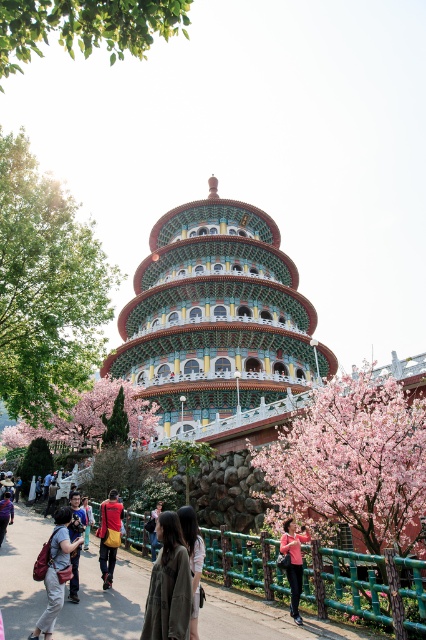
The width and height of the screenshot is (426, 640). What do you see at coordinates (109, 536) in the screenshot? I see `red fabric backpack at center` at bounding box center [109, 536].

Is the position of red fabric backpack at center less distant than that of matte red backpack at center?

Yes, red fabric backpack at center is closer to the viewer.

Is point (112, 492) positioned in front of point (85, 502)?

Yes, point (112, 492) is in front of point (85, 502).

Locate an element on the screen. The image size is (426, 640). red fabric backpack at center is located at coordinates (109, 536).

Looking at this image, does green leafy tree at upper left have a greater height compared to dark gray fabric jacket at lower center?

Yes.

Does green leafy tree at upper left appear on the right side of dark gray fabric jacket at lower center?

No, green leafy tree at upper left is not to the right of dark gray fabric jacket at lower center.

Is point (94, 36) less distant than point (144, 618)?

No, (94, 36) is further to viewer.

This screenshot has height=640, width=426. In order to click on green leafy tree at upper left in this screenshot , I will do `click(86, 26)`.

Is matte black backpack at lower center in front of dark gray fabric jacket at center?

No, matte black backpack at lower center is behind dark gray fabric jacket at center.

Locate an element on the screen. This screenshot has height=640, width=426. matte black backpack at lower center is located at coordinates (55, 572).

Is point (63, 560) positioned before point (192, 636)?

No, it is behind (192, 636).

The height and width of the screenshot is (640, 426). Find the location of `matte black backpack at lower center`. matte black backpack at lower center is located at coordinates (55, 572).